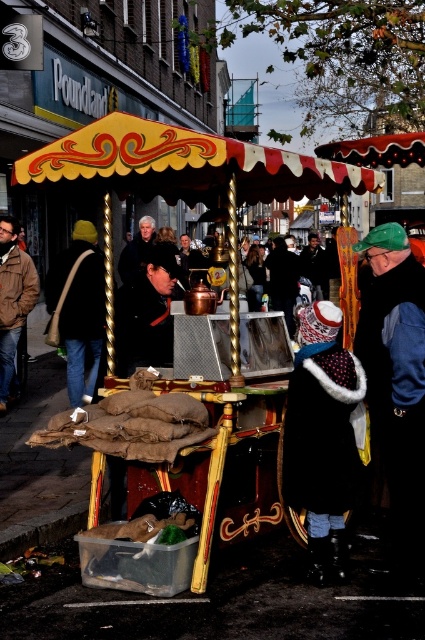
Question: Among these points, which one is farthest from the camera?

Choices:
 (A) (260, 304)
 (B) (8, 240)
 (C) (142, 244)
 (D) (308, 564)

Answer: (A)

Question: Which object appears closest to the camera in this image?

Choices:
 (A) dark brown leather jacket at center
 (B) matte black hat at center
 (C) gold polished cart at center
 (D) dark blue jacket at lower right

Answer: (C)

Question: Does dark blue jacket at lower right appear under velvet hat at center?

Choices:
 (A) no
 (B) yes

Answer: (B)

Question: Can you confirm if dark blue jacket at lower right is bigger than matte black hat at center?

Choices:
 (A) no
 (B) yes

Answer: (A)

Question: Does velvet black coat at center come behind brown leather jacket at center?

Choices:
 (A) yes
 (B) no

Answer: (B)

Question: Which point appears closest to the camera in this image?

Choices:
 (A) (164, 244)
 (B) (416, 266)
 (C) (331, 339)

Answer: (C)